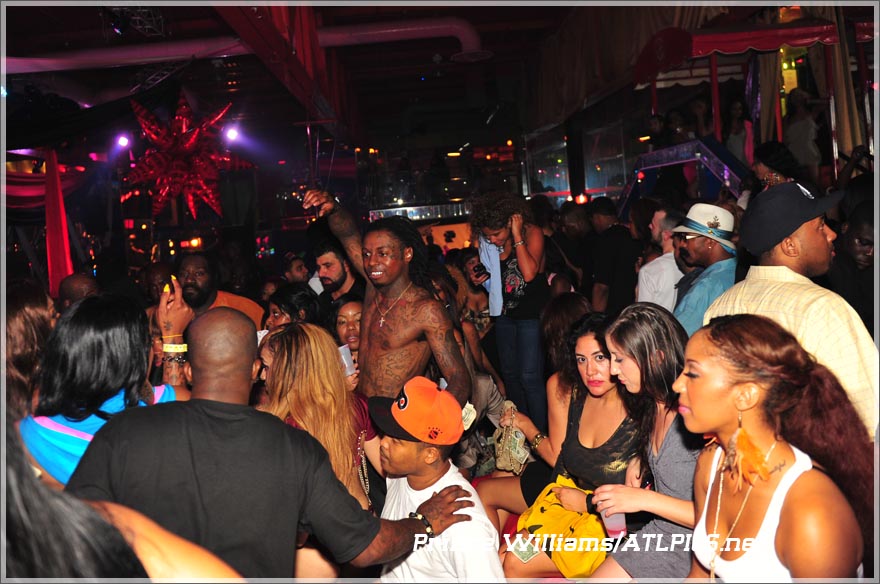
I want to click on balloon decor, so click(x=191, y=156).